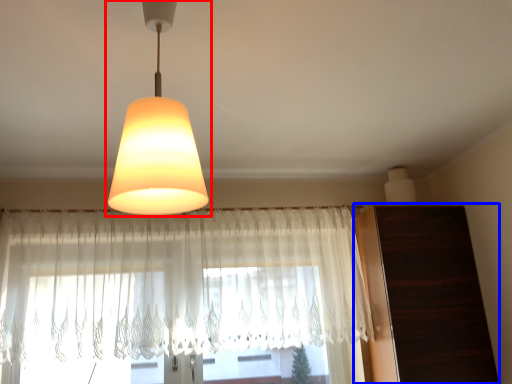
Question: Which point is further to the camera, lamp (highlighted by a red box) or dresser (highlighted by a blue box)?

Choices:
 (A) lamp
 (B) dresser

Answer: (B)